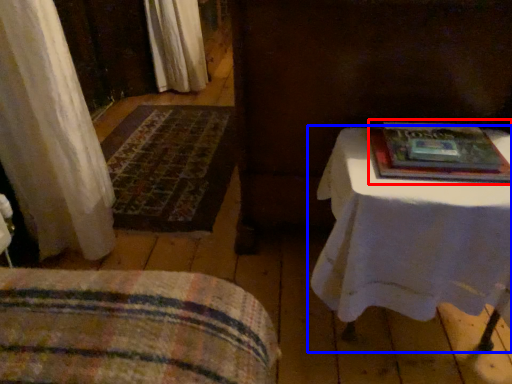
Question: Which object is closer to the camera taking this photo, paperback book (highlighted by a red box) or table (highlighted by a blue box)?

Choices:
 (A) paperback book
 (B) table

Answer: (B)